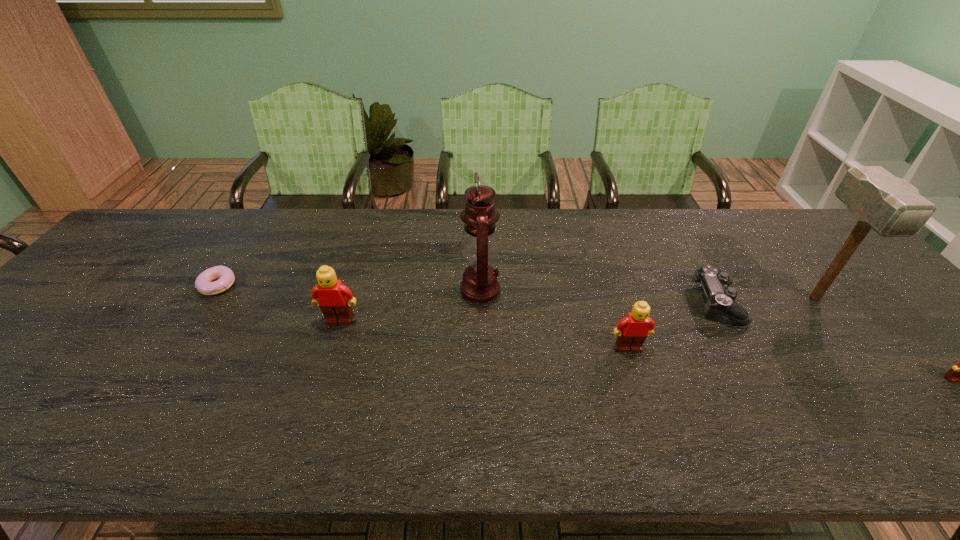
Please point a free position for a Lego on the left. Please provide its 2D coordinates. Your answer should be formatted as a tuple, i.e. [(x, y)], where the tuple contains the x and y coordinates of a point satisfying the conditions above.

[(83, 296)]